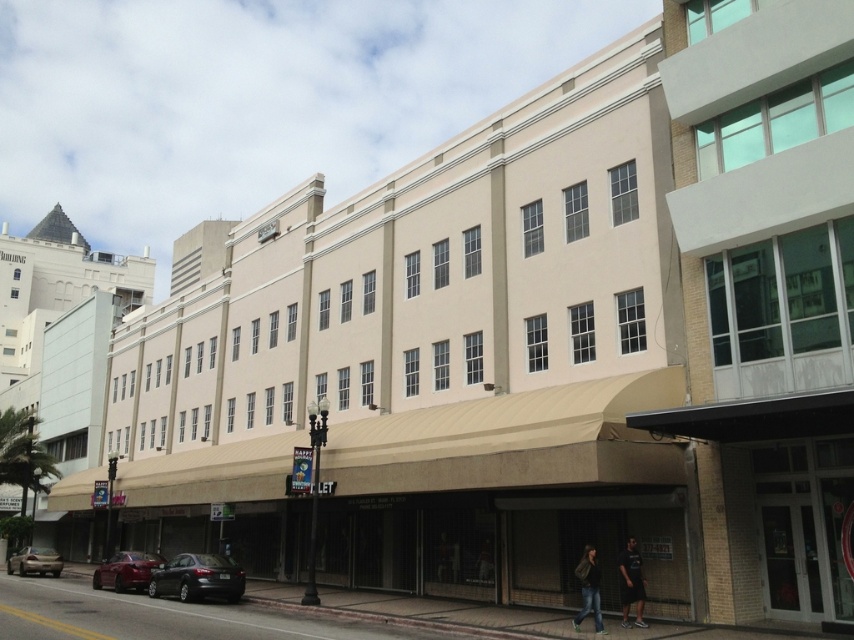
You are a window cleaner who needs to clean the white glass windows at upper center and the shiny black sedan at lower left. Which one will require a ladder to clean?

The white glass windows at upper center will require a ladder because they are much taller than the shiny black sedan at lower left.

You are standing on the sidewalk in front of the building and want to take a photo that includes both the point at coordinates (574,572) and the point at coordinates (47,568). Which point will appear larger in your photo?

Point at coordinates (574,572) will appear larger in the photo because it is closer to the camera than point at coordinates (47,568).